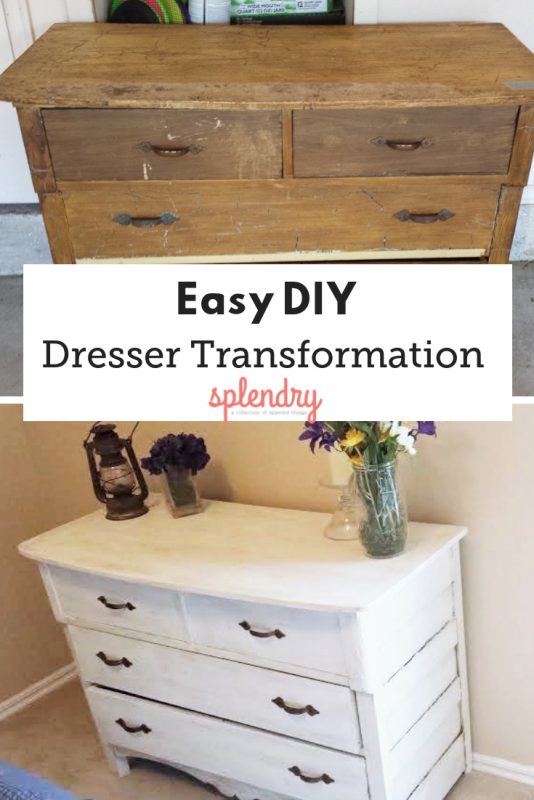
The height and width of the screenshot is (800, 534). I want to click on candle, so click(344, 470).